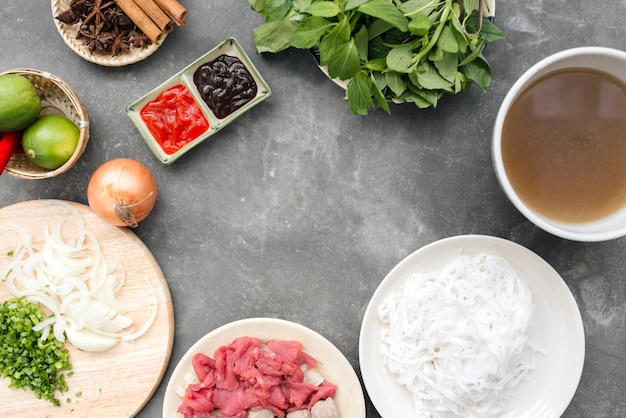
This screenshot has width=626, height=418. What are the coordinates of `white plate` in the screenshot? It's located at (560, 289).